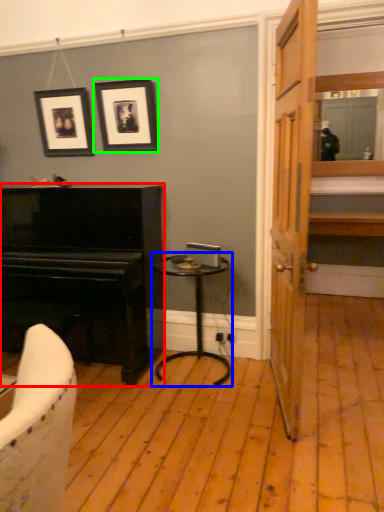
Question: Estimate the real-world distances between objects in this image. Which object is farther from piano (highlighted by a red box), table (highlighted by a blue box) or picture frame (highlighted by a green box)?

Choices:
 (A) table
 (B) picture frame

Answer: (B)